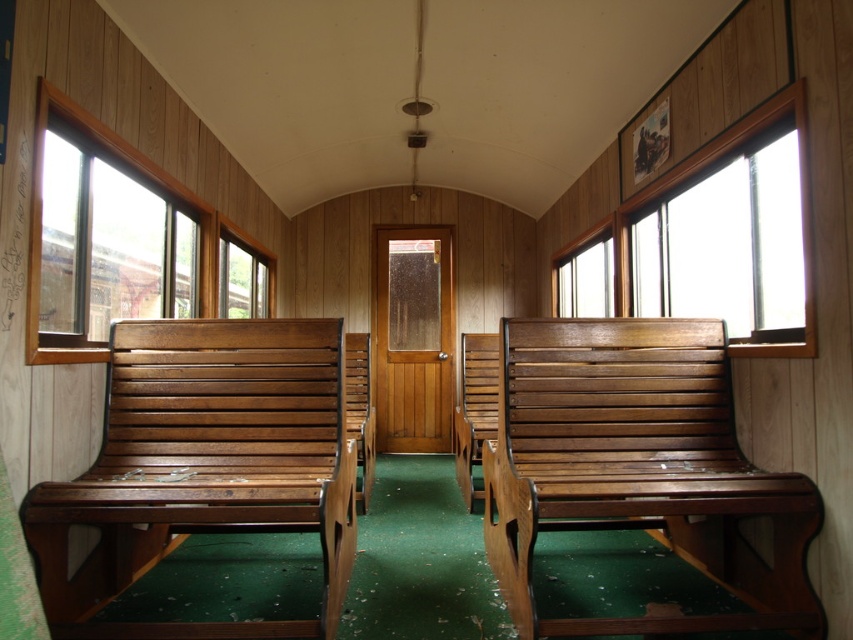
Question: Which object is closer to the camera taking this photo?

Choices:
 (A) shiny brown wood bench at left
 (B) clear glass window at center
 (C) clear glass window at center right

Answer: (A)

Question: Is clear glass window at upper right closer to the viewer compared to clear glass window at center?

Choices:
 (A) no
 (B) yes

Answer: (B)

Question: Considering the real-world distances, which object is closest to the shiny brown wood bench at center?

Choices:
 (A) clear glass window at upper right
 (B) clear glass window at left

Answer: (A)

Question: Does clear glass window at left appear under clear glass window at center right?

Choices:
 (A) no
 (B) yes

Answer: (A)

Question: Can you confirm if shiny brown wood bench at center is positioned to the left of shiny brown wood bench at left?

Choices:
 (A) no
 (B) yes

Answer: (A)

Question: Which point appears farthest from the camera in this image?

Choices:
 (A) (57, 180)
 (B) (247, 440)
 (C) (700, 312)

Answer: (C)